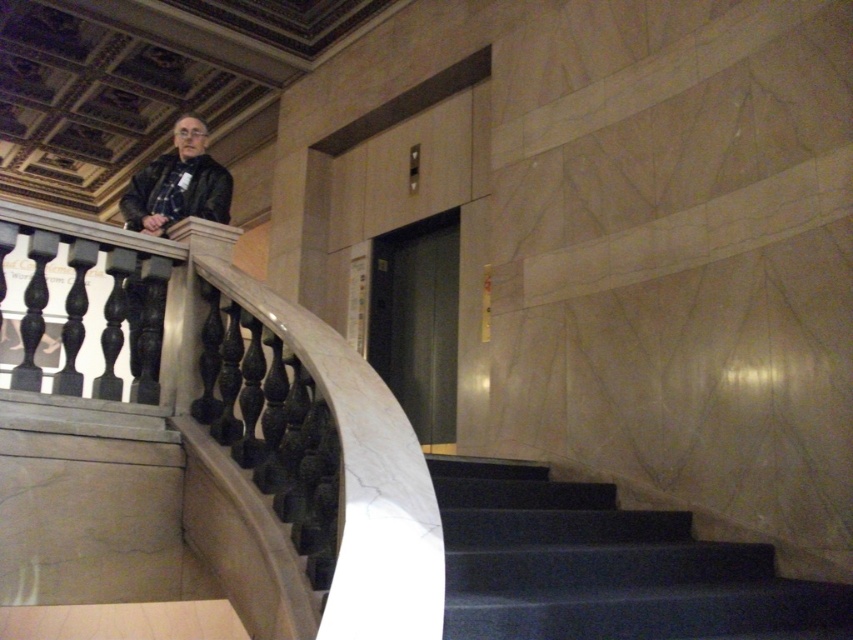
Question: In this image, where is dark gray carpeted stairs at lower center located relative to matte black jacket at upper left?

Choices:
 (A) left
 (B) right

Answer: (B)

Question: Can you confirm if dark gray carpeted stairs at lower center is wider than matte black jacket at left?

Choices:
 (A) yes
 (B) no

Answer: (A)

Question: Can you confirm if white marble railing at upper left is thinner than matte black jacket at left?

Choices:
 (A) yes
 (B) no

Answer: (B)

Question: Which of the following is the closest to the observer?

Choices:
 (A) (634, 612)
 (B) (222, 193)

Answer: (A)

Question: Which object is positioned farthest from the matte black jacket at left?

Choices:
 (A) matte black jacket at upper left
 (B) dark gray carpeted stairs at lower center
 (C) white marble railing at upper left

Answer: (B)

Question: Which of these objects is positioned closest to the dark gray carpeted stairs at lower center?

Choices:
 (A) matte black jacket at left
 (B) white marble railing at upper left
 (C) matte black jacket at upper left

Answer: (B)